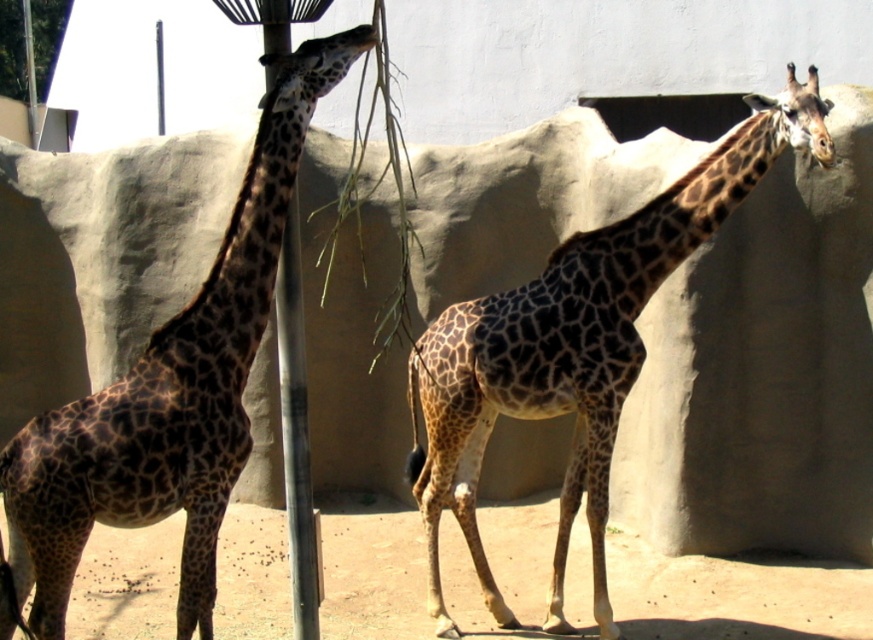
Question: Which of the following is the closest to the observer?

Choices:
 (A) (652, 276)
 (B) (127, 403)

Answer: (B)

Question: Does spotted fur giraffe at left appear over spotted fur giraffe at center?

Choices:
 (A) no
 (B) yes

Answer: (B)

Question: Which object is farther from the camera taking this photo?

Choices:
 (A) spotted fur giraffe at left
 (B) spotted fur giraffe at center

Answer: (B)

Question: Is spotted fur giraffe at left further to camera compared to spotted fur giraffe at center?

Choices:
 (A) yes
 (B) no

Answer: (B)

Question: Does spotted fur giraffe at left have a greater width compared to spotted fur giraffe at center?

Choices:
 (A) yes
 (B) no

Answer: (B)